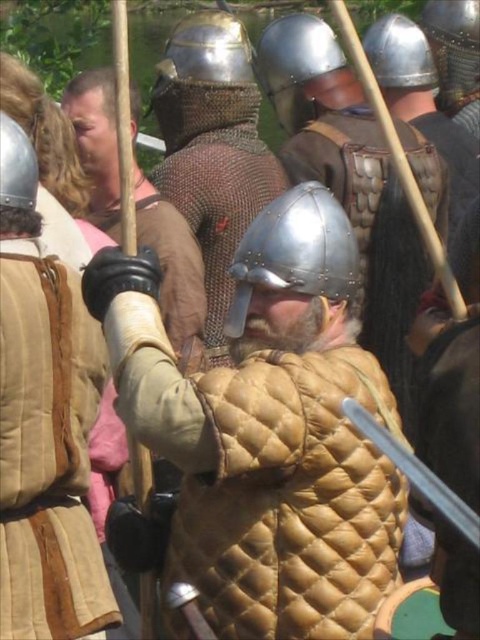
You are standing at the center of the image. Where is the brown quilted armor at center located relative to your position?

The brown quilted armor at center is located at point (48, 452) relative to your position.

You are a knight in the medieval reenactment and need to retrieve your metallic silver sword at center from the ground. The matte gold quilted armor at center is blocking your path. Can you step around to the right to reach the sword?

The matte gold quilted armor at center is to the left of metallic silver sword at center, so stepping to the right would allow you to bypass the armor and reach the sword.

You are standing at the origin point in the image. Which of the two points, point (9, 448) or point (172, 83), is closer to you?

Point (9, 448) is closer to you because it is in front of point (172, 83).